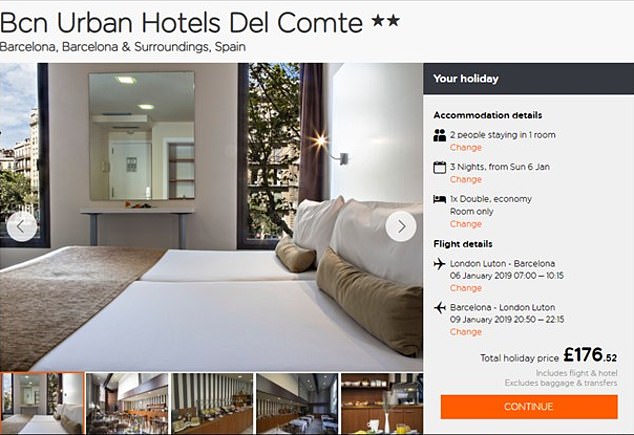
Locate an element on the screen. This screenshot has width=634, height=435. white pillows is located at coordinates (371, 257), (311, 230).